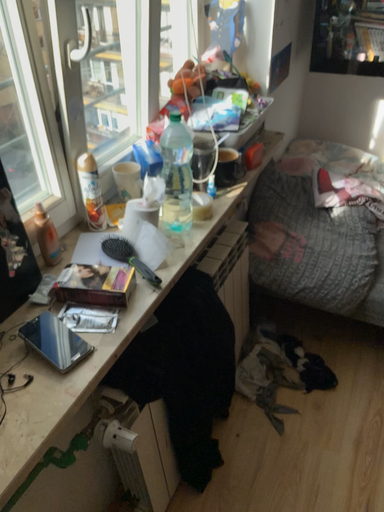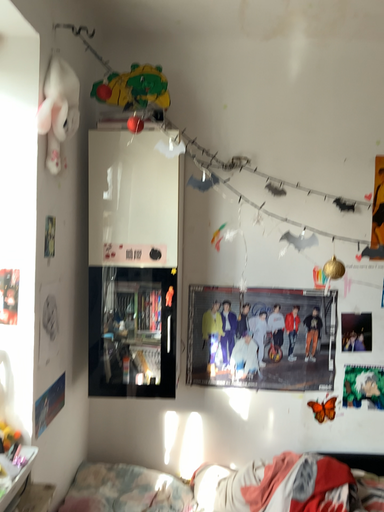
Question: How did the camera likely rotate when shooting the video?

Choices:
 (A) rotated right
 (B) rotated left

Answer: (A)